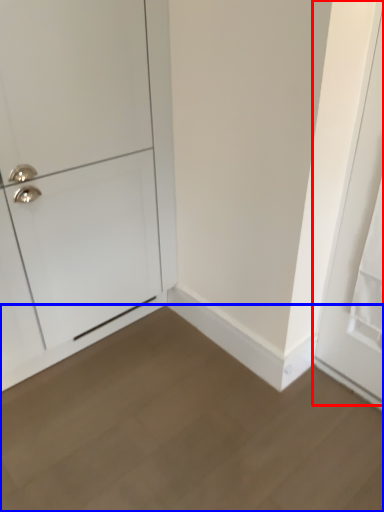
Question: Which object appears closest to the camera in this image, door (highlighted by a red box) or plain (highlighted by a blue box)?

Choices:
 (A) door
 (B) plain

Answer: (B)